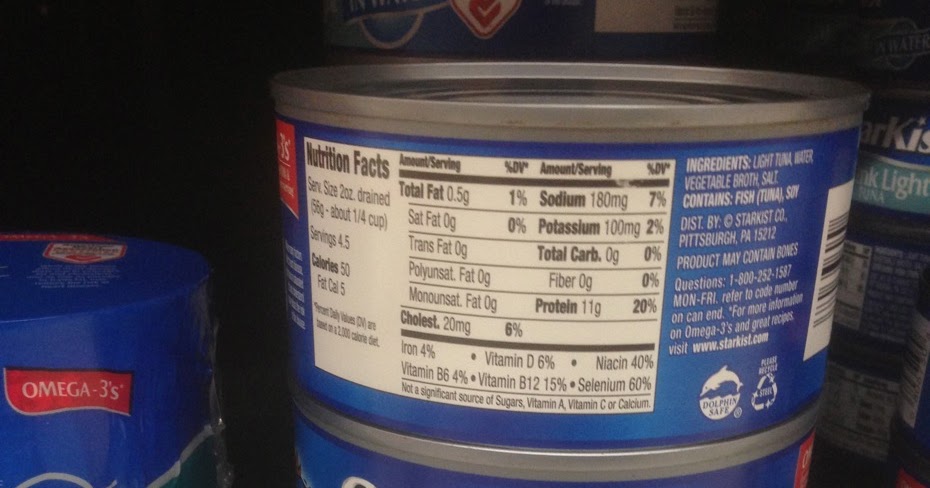
This screenshot has height=488, width=930. Identify the location of led. (715, 86).